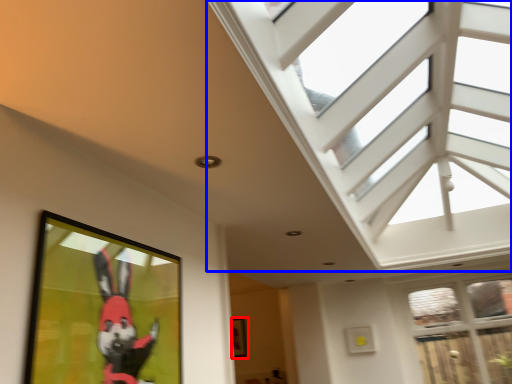
Question: Which point is further to the camera, picture frame (highlighted by a red box) or window (highlighted by a blue box)?

Choices:
 (A) picture frame
 (B) window

Answer: (A)